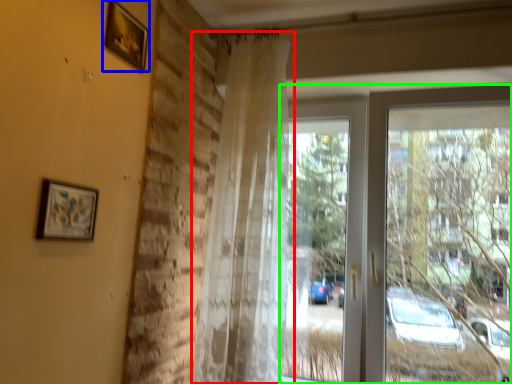
Question: Considering the real-world distances, which object is closest to curtain (highlighted by a red box)? picture frame (highlighted by a blue box) or window (highlighted by a green box).

Choices:
 (A) picture frame
 (B) window

Answer: (B)